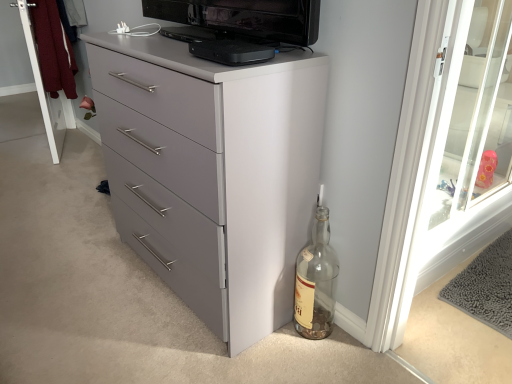
This screenshot has width=512, height=384. Identify the location of transparent glass screen door at upper right, which is counted as the 1th screen door, starting from the front. (453, 141).

This screenshot has width=512, height=384. Describe the element at coordinates (213, 172) in the screenshot. I see `matte gray chest of drawers at center` at that location.

What is the approximate height of white wood screen door at upper left, placed as the first screen door when sorted from left to right?

It is 1.01 meters.

Locate an element on the screen. transparent glass screen door at upper right, the 2th screen door from the back is located at coordinates (453, 141).

Is transparent glass screen door at upper right, which is counted as the 1th screen door, starting from the front, looking in the opposite direction of matte gray chest of drawers at center?

No.

Is transparent glass screen door at upper right, which is the 2th screen door in left-to-right order, far away from matte gray chest of drawers at center?

No, transparent glass screen door at upper right, which is the 2th screen door in left-to-right order, is not far from matte gray chest of drawers at center.

Which is less distant, (481, 12) or (136, 166)?

Positioned in front is point (481, 12).

What's the angular difference between transparent glass screen door at upper right, which is the 2th screen door in left-to-right order, and matte gray chest of drawers at center's facing directions?

The angular difference between transparent glass screen door at upper right, which is the 2th screen door in left-to-right order, and matte gray chest of drawers at center is 90.7 degrees.

From the image's perspective, which one is positioned lower, matte gray chest of drawers at center or white wood screen door at upper left, positioned as the second screen door in front-to-back order?

matte gray chest of drawers at center is shown below in the image.

In the scene shown: Can you confirm if matte gray chest of drawers at center is smaller than white wood screen door at upper left, positioned as the second screen door in front-to-back order?

No, matte gray chest of drawers at center is not smaller than white wood screen door at upper left, positioned as the second screen door in front-to-back order.

Is white wood screen door at upper left, which is counted as the second screen door, starting from the right, a part of matte gray chest of drawers at center?

Actually, white wood screen door at upper left, which is counted as the second screen door, starting from the right, is outside matte gray chest of drawers at center.

Considering the positions of point (160, 82) and point (18, 6), is point (160, 82) closer or farther from the camera than point (18, 6)?

Point (160, 82) appears to be closer to the viewer than point (18, 6).

Is white wood screen door at upper left, positioned as the second screen door in front-to-back order, directly adjacent to matte gray chest of drawers at center?

No.

Measure the distance between white wood screen door at upper left, positioned as the second screen door in front-to-back order, and matte gray chest of drawers at center.

5.92 feet.

From the image's perspective, is white wood screen door at upper left, the first screen door positioned from the back, located above or below matte gray chest of drawers at center?

From the image's perspective, white wood screen door at upper left, the first screen door positioned from the back, appears above matte gray chest of drawers at center.

Can you tell me how much white wood screen door at upper left, positioned as the second screen door in front-to-back order, and matte gray chest of drawers at center differ in facing direction?

The facing directions of white wood screen door at upper left, positioned as the second screen door in front-to-back order, and matte gray chest of drawers at center are 21.4 degrees apart.

Is black plastic device at upper center positioned with its back to matte gray chest of drawers at center?

No, matte gray chest of drawers at center is not at the back of black plastic device at upper center.

Looking at this image, does black plastic device at upper center appear on the right side of matte gray chest of drawers at center?

Yes.

From the picture: Can you confirm if black plastic device at upper center is thinner than matte gray chest of drawers at center?

Yes, black plastic device at upper center is thinner than matte gray chest of drawers at center.

Would you say black plastic device at upper center is a long distance from matte gray chest of drawers at center?

No, there isn't a large distance between black plastic device at upper center and matte gray chest of drawers at center.

Considering the relative positions of transparent glass screen door at upper right, which is the 1th screen door in right-to-left order, and black plastic device at upper center in the image provided, is transparent glass screen door at upper right, which is the 1th screen door in right-to-left order, behind black plastic device at upper center?

That is True.

Looking at this image, would you say transparent glass screen door at upper right, the 2th screen door from the back, contains black plastic device at upper center?

No, black plastic device at upper center is not a part of transparent glass screen door at upper right, the 2th screen door from the back.

Is transparent glass screen door at upper right, which is the 1th screen door in right-to-left order, taller than black plastic device at upper center?

Yes.

Is the position of clear glass bottle at lower right less distant than that of matte gray chest of drawers at center?

No.

Which object is wider, clear glass bottle at lower right or matte gray chest of drawers at center?

With larger width is matte gray chest of drawers at center.

From the picture: Are clear glass bottle at lower right and matte gray chest of drawers at center far apart?

No, there isn't a large distance between clear glass bottle at lower right and matte gray chest of drawers at center.

Could you tell me if clear glass bottle at lower right is facing matte gray chest of drawers at center?

No.

Is clear glass bottle at lower right positioned with its back to white wood screen door at upper left, positioned as the second screen door in front-to-back order?

That's not correct — clear glass bottle at lower right is not looking away from white wood screen door at upper left, positioned as the second screen door in front-to-back order.

Between clear glass bottle at lower right and white wood screen door at upper left, positioned as the second screen door in front-to-back order, which one has smaller size?

clear glass bottle at lower right is smaller.

Based on the photo, between clear glass bottle at lower right and white wood screen door at upper left, which is counted as the second screen door, starting from the right, which one appears on the right side from the viewer's perspective?

clear glass bottle at lower right.

Is clear glass bottle at lower right with white wood screen door at upper left, positioned as the second screen door in front-to-back order?

No, clear glass bottle at lower right is not next to white wood screen door at upper left, positioned as the second screen door in front-to-back order.

Image resolution: width=512 pixels, height=384 pixels. Find the location of `the 2nd screen door directly above the matte gray chest of drawers at center (from a real-world perspective)`. the 2nd screen door directly above the matte gray chest of drawers at center (from a real-world perspective) is located at coordinates (453, 141).

Locate an element on the screen. The image size is (512, 384). chest of drawers below the white wood screen door at upper left, which is counted as the second screen door, starting from the right (from the image's perspective) is located at coordinates (213, 172).

Looking at the image, which one is located closer to clear glass bottle at lower right, transparent glass screen door at upper right, the 2th screen door from the back, or white wood screen door at upper left, which is counted as the second screen door, starting from the right?

transparent glass screen door at upper right, the 2th screen door from the back, is closer to clear glass bottle at lower right.

Which object lies further to the anchor point matte gray chest of drawers at center, transparent glass screen door at upper right, the 2th screen door from the back, or white wood screen door at upper left, placed as the first screen door when sorted from left to right?

white wood screen door at upper left, placed as the first screen door when sorted from left to right, lies further to matte gray chest of drawers at center than the other object.

When comparing their distances from clear glass bottle at lower right, does white wood screen door at upper left, placed as the first screen door when sorted from left to right, or transparent glass screen door at upper right, which is the 1th screen door in right-to-left order, seem closer?

transparent glass screen door at upper right, which is the 1th screen door in right-to-left order, is positioned closer to the anchor clear glass bottle at lower right.

From the image, which object appears to be nearer to transparent glass screen door at upper right, which is the 1th screen door in right-to-left order, white wood screen door at upper left, placed as the first screen door when sorted from left to right, or black plastic device at upper center?

black plastic device at upper center lies closer to transparent glass screen door at upper right, which is the 1th screen door in right-to-left order, than the other object.

Based on their spatial positions, is matte gray chest of drawers at center or black plastic device at upper center closer to transparent glass screen door at upper right, which is the 1th screen door in right-to-left order?

Among the two, matte gray chest of drawers at center is located nearer to transparent glass screen door at upper right, which is the 1th screen door in right-to-left order.

Based on their spatial positions, is transparent glass screen door at upper right, which is counted as the 1th screen door, starting from the front, or clear glass bottle at lower right further from black plastic device at upper center?

Based on the image, transparent glass screen door at upper right, which is counted as the 1th screen door, starting from the front, appears to be further to black plastic device at upper center.

When comparing their distances from transparent glass screen door at upper right, which is counted as the 1th screen door, starting from the front, does black plastic device at upper center or matte gray chest of drawers at center seem closer?

matte gray chest of drawers at center lies closer to transparent glass screen door at upper right, which is counted as the 1th screen door, starting from the front, than the other object.

When comparing their distances from black plastic device at upper center, does white wood screen door at upper left, placed as the first screen door when sorted from left to right, or clear glass bottle at lower right seem further?

Based on the image, white wood screen door at upper left, placed as the first screen door when sorted from left to right, appears to be further to black plastic device at upper center.

This screenshot has height=384, width=512. I want to click on appliance situated between matte gray chest of drawers at center and transparent glass screen door at upper right, the 2th screen door from the back, from left to right, so click(x=232, y=52).

This screenshot has height=384, width=512. I want to click on glass bottle between white wood screen door at upper left, placed as the first screen door when sorted from left to right, and transparent glass screen door at upper right, which is the 2th screen door in left-to-right order, so click(x=316, y=282).

Find the location of a particular element. The width and height of the screenshot is (512, 384). appliance between white wood screen door at upper left, positioned as the second screen door in front-to-back order, and transparent glass screen door at upper right, the 2th screen door from the back, from left to right is located at coordinates (232, 52).

What are the coordinates of `chest of drawers between white wood screen door at upper left, the first screen door positioned from the back, and transparent glass screen door at upper right, which is the 2th screen door in left-to-right order, from left to right` in the screenshot? It's located at (213, 172).